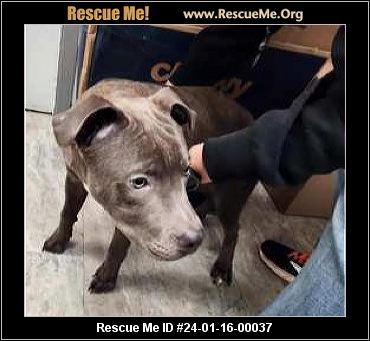
The image size is (370, 341). What are the coordinates of `linoleum floor` in the screenshot? It's located at (171, 285).